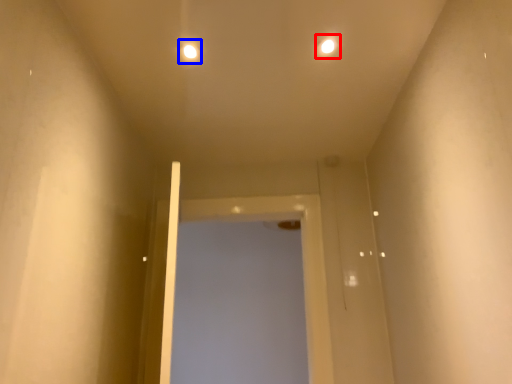
Question: Which object appears closest to the camera in this image, light (highlighted by a red box) or light (highlighted by a blue box)?

Choices:
 (A) light
 (B) light

Answer: (A)